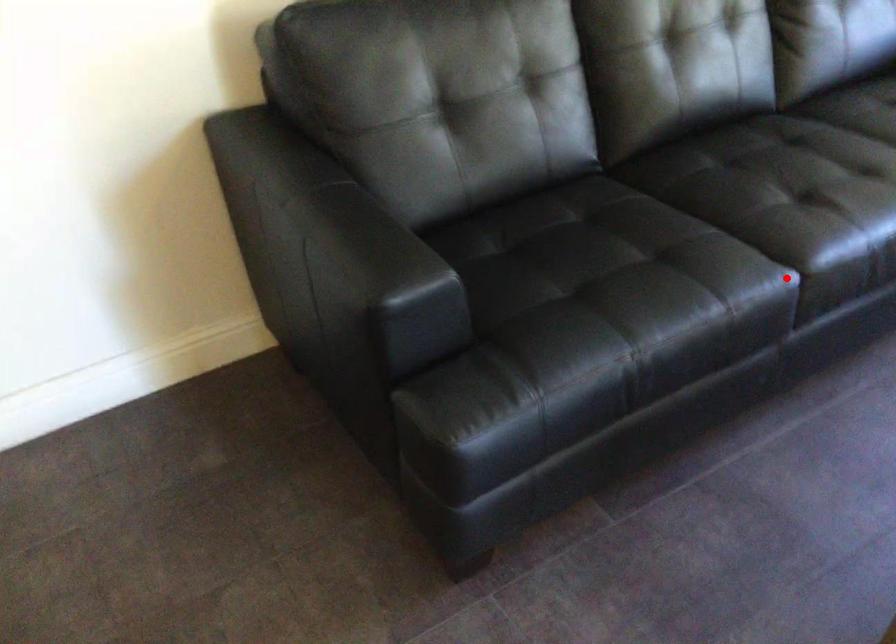
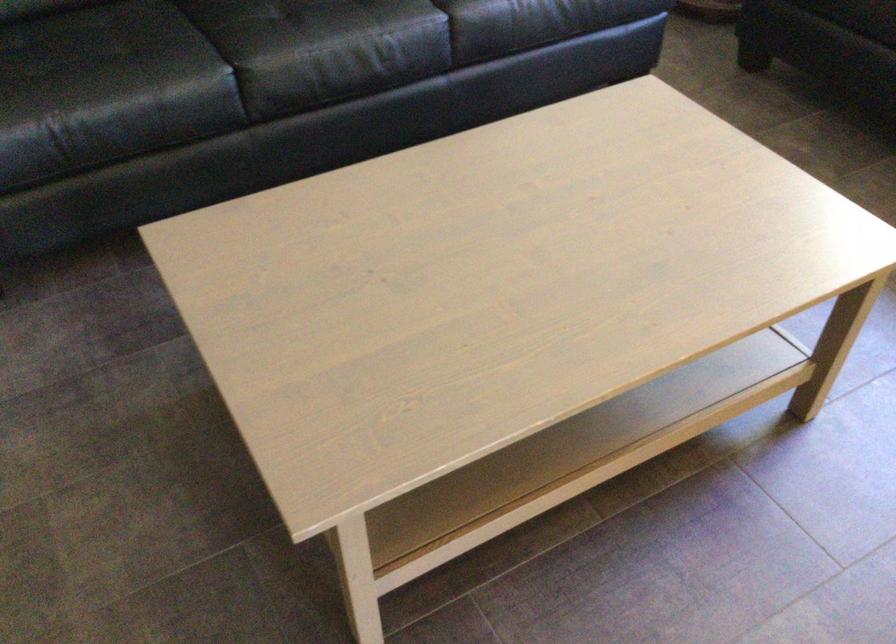
Question: I am providing you with two images of the same scene from different viewpoints. Given a red point in image1, look at the same physical point in image2. Is it:

Choices:
 (A) Closer to the viewpoint
 (B) Farther from the viewpoint

Answer: (B)